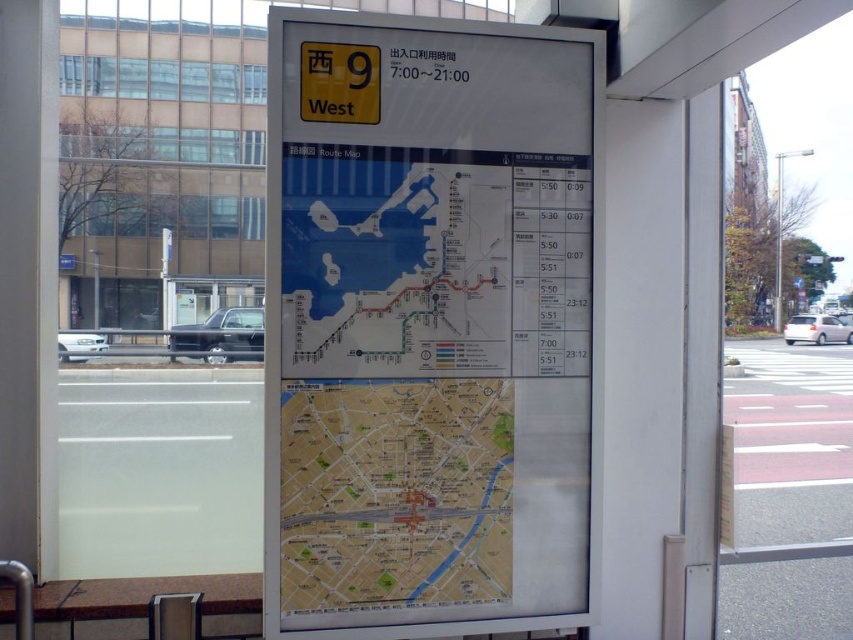
Can you confirm if white paper map at center is thinner than yellow paper map at center?

Incorrect, white paper map at center's width is not less than yellow paper map at center's.

Between point (549, 310) and point (289, 406), which one is positioned behind?

Point (549, 310)

Locate an element on the screen. The height and width of the screenshot is (640, 853). white paper map at center is located at coordinates (433, 262).